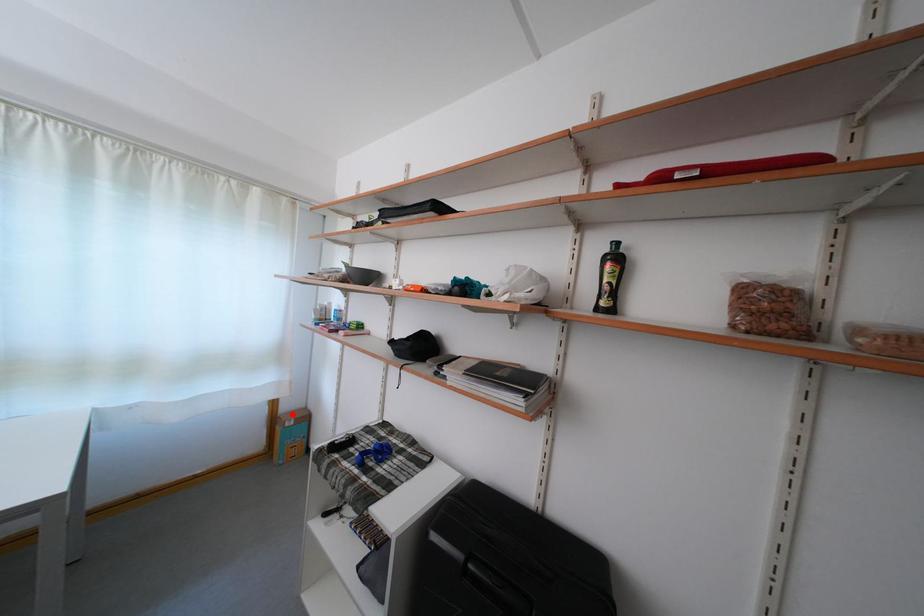
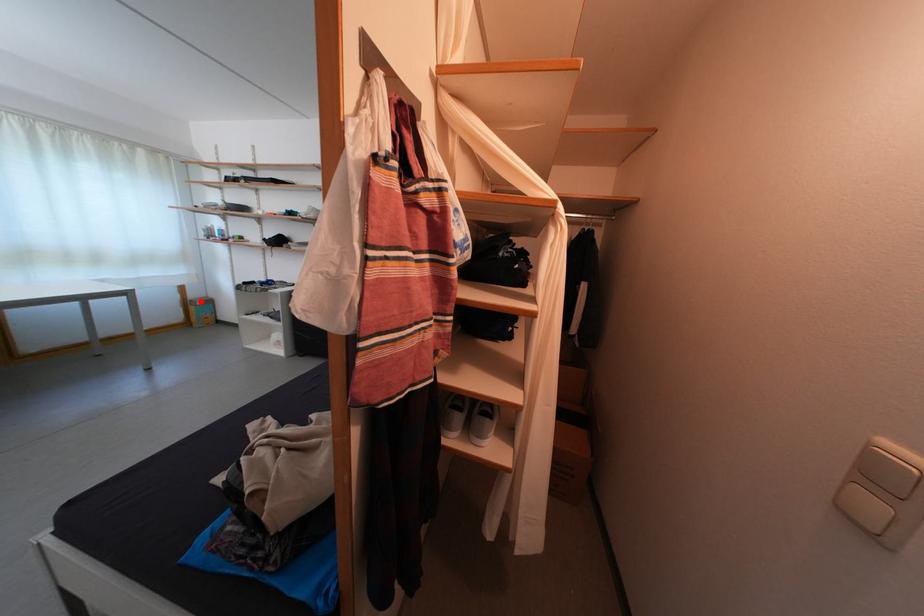
I am providing you with two images of the same scene from different viewpoints. A red point is marked on the first image and another point is marked on the second image. Is the red point in image1 aligned with the point shown in image2?

Yes